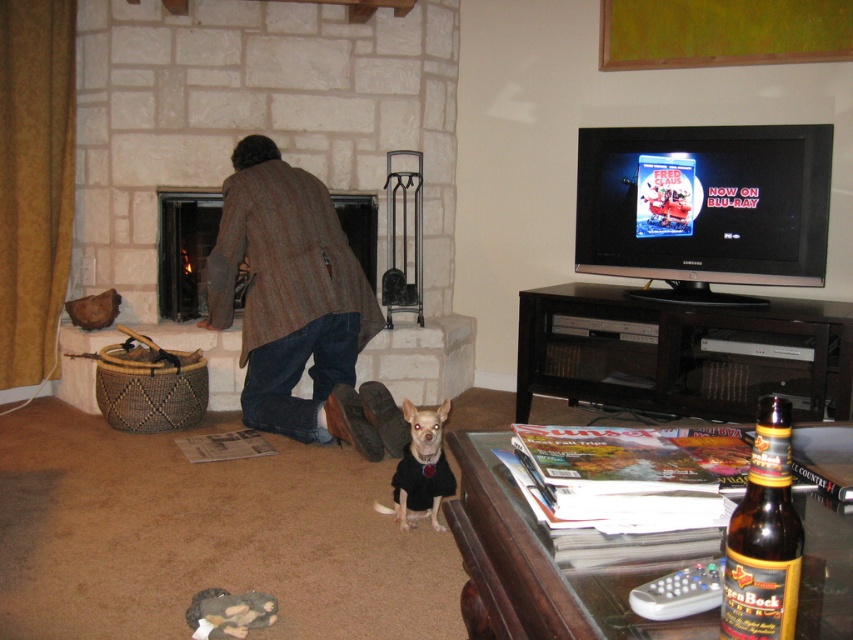
Between point (274, 160) and point (163, 282), which one is positioned in front?

Point (274, 160) is in front.

Is brown wool coat at center to the right of brown woolen fireplace at center from the viewer's perspective?

Indeed, brown wool coat at center is positioned on the right side of brown woolen fireplace at center.

Identify the location of brown wool coat at center. [x=288, y=292].

Can you confirm if brown woolen fireplace at center is positioned above white fur dog at center?

Yes.

Is point (172, 196) farther from viewer compared to point (405, 522)?

Yes.

Between point (190, 218) and point (433, 426), which one is positioned behind?

The point (190, 218) is behind.

You are a GUI agent. You are given a task and a screenshot of the screen. Output one action in this format:
    pyautogui.click(x=<x>, y=<y>)
    Task: Click on the brown woolen fireplace at center
    Image resolution: width=853 pixels, height=640 pixels.
    Given the screenshot: What is the action you would take?
    pyautogui.click(x=184, y=250)

Does brown glass beer bottle at lower right lie behind white fur dog at center?

No.

Is brown glass beer bottle at lower right thinner than white fur dog at center?

Yes, brown glass beer bottle at lower right is thinner than white fur dog at center.

Where is `brown glass beer bottle at lower right`? Image resolution: width=853 pixels, height=640 pixels. brown glass beer bottle at lower right is located at coordinates (764, 538).

Where is `brown glass beer bottle at lower right`? The image size is (853, 640). brown glass beer bottle at lower right is located at coordinates (764, 538).